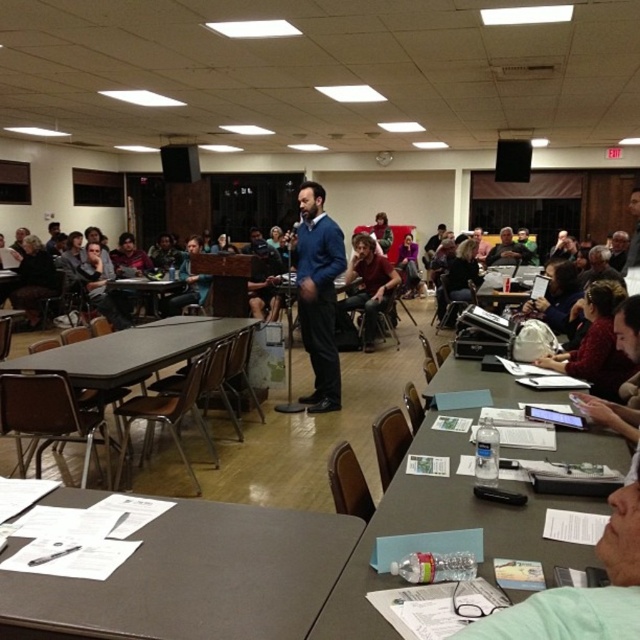
Question: Is metallic silver table at center wider than matte black jacket at upper center?

Choices:
 (A) yes
 (B) no

Answer: (A)

Question: Based on their relative distances, which object is farther from the matte black jacket at upper center?

Choices:
 (A) matte brown table at center
 (B) matte blue sweater at center

Answer: (A)

Question: Which object is closer to the camera taking this photo?

Choices:
 (A) matte black jacket at upper center
 (B) metallic silver table at center
 (C) matte black table at left
 (D) matte blue sweater at center

Answer: (D)

Question: Can you confirm if matte blue sweater at center is bigger than matte black jacket at upper center?

Choices:
 (A) no
 (B) yes

Answer: (A)

Question: Among these points, which one is nearest to the camera?

Choices:
 (A) (496, 246)
 (B) (49, 355)
 (C) (488, 538)
 (D) (268, 524)

Answer: (C)

Question: Is clear plastic water bottle at lower right above matte black table at left?

Choices:
 (A) yes
 (B) no

Answer: (B)